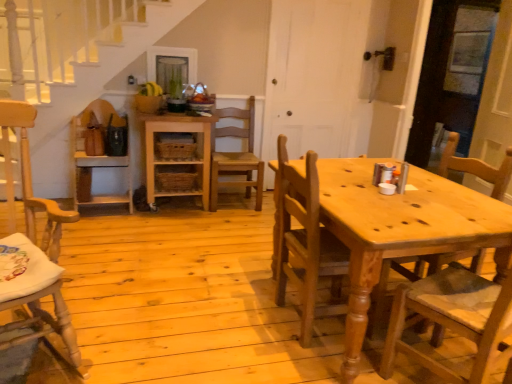
Measure the distance between point (20, 124) and camera.

Point (20, 124) and camera are 10.58 feet apart from each other.

Locate an element on the screen. This screenshot has width=512, height=384. natural wood chair at center, the 4th chair from the left is located at coordinates (304, 242).

This screenshot has height=384, width=512. I want to click on wooden chair at right, marked as the first chair in a right-to-left arrangement, so (x=450, y=320).

What do you see at coordinates (236, 156) in the screenshot? Image resolution: width=512 pixels, height=384 pixels. I see `wooden chair at center, the 3th chair viewed from the right` at bounding box center [236, 156].

This screenshot has width=512, height=384. Describe the element at coordinates (176, 156) in the screenshot. I see `natural wood shelf at center` at that location.

At what (x,y) coordinates should I click in order to perform the action: click on natural wood shelf at center. Please return your answer as a coordinate pair (x, y). Looking at the image, I should click on (176, 156).

You are a GUI agent. You are given a task and a screenshot of the screen. Output one action in this format:
    pyautogui.click(x=<x>, y=<y>)
    Task: Click on the light brown wood chair at left, marked as the 2th chair in a left-to-right arrangement
    The width and height of the screenshot is (512, 384).
    Given the screenshot: What is the action you would take?
    pyautogui.click(x=30, y=182)

Does point (419, 358) come closer to viewer compared to point (66, 338)?

No, it is not.

Based on the photo, considering the sizes of wooden chair at right, marked as the first chair in a right-to-left arrangement, and light brown wood chair at left, which is counted as the fourth chair, starting from the right, in the image, is wooden chair at right, marked as the first chair in a right-to-left arrangement, wider or thinner than light brown wood chair at left, which is counted as the fourth chair, starting from the right,?

wooden chair at right, marked as the first chair in a right-to-left arrangement, is thinner than light brown wood chair at left, which is counted as the fourth chair, starting from the right.

Is wooden chair at right, marked as the first chair in a right-to-left arrangement, turned away from light brown wood chair at left, marked as the 2th chair in a left-to-right arrangement?

wooden chair at right, marked as the first chair in a right-to-left arrangement, does not have its back to light brown wood chair at left, marked as the 2th chair in a left-to-right arrangement.

What's the angular difference between wooden chair at right, marked as the first chair in a right-to-left arrangement, and light brown wood chair at left, which is counted as the fourth chair, starting from the right,'s facing directions?

They differ by 178 degrees in their facing directions.

Is wooden chair at right, acting as the fifth chair starting from the left, thinner than wooden chair at center, arranged as the 3th chair when viewed from the left?

Yes, wooden chair at right, acting as the fifth chair starting from the left, is thinner than wooden chair at center, arranged as the 3th chair when viewed from the left.

Is wooden chair at right, marked as the first chair in a right-to-left arrangement, not within wooden chair at center, arranged as the 3th chair when viewed from the left?

Yes, wooden chair at right, marked as the first chair in a right-to-left arrangement, is located beyond the bounds of wooden chair at center, arranged as the 3th chair when viewed from the left.

In the scene shown: Considering the relative sizes of wooden chair at right, marked as the first chair in a right-to-left arrangement, and wooden chair at center, arranged as the 3th chair when viewed from the left, in the image provided, is wooden chair at right, marked as the first chair in a right-to-left arrangement, shorter than wooden chair at center, arranged as the 3th chair when viewed from the left,?

In fact, wooden chair at right, marked as the first chair in a right-to-left arrangement, may be taller than wooden chair at center, arranged as the 3th chair when viewed from the left.

Does point (457, 313) come in front of point (248, 155)?

Yes, point (457, 313) is closer to viewer.

Is light brown wood chair at left, which is counted as the fourth chair, starting from the right, looking in the opposite direction of wooden chair at center, the 3th chair viewed from the right?

No, wooden chair at center, the 3th chair viewed from the right, is not at the back of light brown wood chair at left, which is counted as the fourth chair, starting from the right.

Does light brown wood chair at left, which is counted as the fourth chair, starting from the right, have a larger size compared to wooden chair at center, arranged as the 3th chair when viewed from the left?

Yes, light brown wood chair at left, which is counted as the fourth chair, starting from the right, is bigger than wooden chair at center, arranged as the 3th chair when viewed from the left.

Between light brown wood chair at left, marked as the 2th chair in a left-to-right arrangement, and wooden chair at center, the 3th chair viewed from the right, which one has more height?

light brown wood chair at left, marked as the 2th chair in a left-to-right arrangement, is taller.

Considering the positions of objects natural wood chair at center, which appears as the second chair when viewed from the right, and wooden chair at right, acting as the fifth chair starting from the left, in the image provided, who is more to the left, natural wood chair at center, which appears as the second chair when viewed from the right, or wooden chair at right, acting as the fifth chair starting from the left,?

natural wood chair at center, which appears as the second chair when viewed from the right, is more to the left.

Considering the sizes of objects natural wood chair at center, which appears as the second chair when viewed from the right, and wooden chair at right, marked as the first chair in a right-to-left arrangement, in the image provided, who is taller, natural wood chair at center, which appears as the second chair when viewed from the right, or wooden chair at right, marked as the first chair in a right-to-left arrangement,?

With more height is wooden chair at right, marked as the first chair in a right-to-left arrangement.

Is the position of natural wood chair at center, which appears as the second chair when viewed from the right, less distant than that of wooden chair at right, marked as the first chair in a right-to-left arrangement?

No, the depth of natural wood chair at center, which appears as the second chair when viewed from the right, is greater than that of wooden chair at right, marked as the first chair in a right-to-left arrangement.

Is natural wood chair at center, the 4th chair from the left, bigger or smaller than wooden chair at right, marked as the first chair in a right-to-left arrangement?

In the image, natural wood chair at center, the 4th chair from the left, appears to be smaller than wooden chair at right, marked as the first chair in a right-to-left arrangement.

Is light brown wood chair at left, marked as the 2th chair in a left-to-right arrangement, far from wooden chair at right, marked as the first chair in a right-to-left arrangement?

Yes.

From the image's perspective, which object appears higher, light brown wood chair at left, marked as the 2th chair in a left-to-right arrangement, or wooden chair at right, acting as the fifth chair starting from the left?

light brown wood chair at left, marked as the 2th chair in a left-to-right arrangement, is shown above in the image.

Which object is positioned more to the left, light brown wood chair at left, marked as the 2th chair in a left-to-right arrangement, or wooden chair at right, marked as the first chair in a right-to-left arrangement?

light brown wood chair at left, marked as the 2th chair in a left-to-right arrangement, is more to the left.

Is light brown wood chair at left, marked as the 2th chair in a left-to-right arrangement, positioned behind wooden chair at right, acting as the fifth chair starting from the left?

That is False.

How many degrees apart are the facing directions of wooden chair at center, the 3th chair viewed from the right, and natural wood chair at center, the 4th chair from the left?

The angular difference between wooden chair at center, the 3th chair viewed from the right, and natural wood chair at center, the 4th chair from the left, is 91.5 degrees.

Where is `the 1st chair below the natural wood chair at center, which appears as the second chair when viewed from the right (from a real-world perspective)`? the 1st chair below the natural wood chair at center, which appears as the second chair when viewed from the right (from a real-world perspective) is located at coordinates (236, 156).

Is wooden chair at center, arranged as the 3th chair when viewed from the left, oriented away from natural wood chair at center, the 4th chair from the left?

No, wooden chair at center, arranged as the 3th chair when viewed from the left, is not facing away from natural wood chair at center, the 4th chair from the left.

Is wooden chair at center, arranged as the 3th chair when viewed from the left, smaller than natural wood chair at center, the 4th chair from the left?

No.

Is the position of natural wood chair at center, the 4th chair from the left, more distant than that of wooden chair at center, which is counted as the 5th chair, starting from the right?

No, the depth of natural wood chair at center, the 4th chair from the left, is less than that of wooden chair at center, which is counted as the 5th chair, starting from the right.

Could you measure the distance between natural wood chair at center, the 4th chair from the left, and wooden chair at center, the first chair positioned from the left?

6.28 feet.

Is natural wood chair at center, which appears as the second chair when viewed from the right, to the left of wooden chair at center, which is counted as the 5th chair, starting from the right, from the viewer's perspective?

No, natural wood chair at center, which appears as the second chair when viewed from the right, is not to the left of wooden chair at center, which is counted as the 5th chair, starting from the right.

Considering the points (314, 231) and (88, 198), which point is in front, point (314, 231) or point (88, 198)?

The point (314, 231) is in front.

Where is `chair in front of the wooden chair at right, acting as the fifth chair starting from the left`? chair in front of the wooden chair at right, acting as the fifth chair starting from the left is located at coordinates (30, 182).

From the image's perspective, which chair is the 4th one below the wooden chair at center, arranged as the 3th chair when viewed from the left? Please provide its 2D coordinates.

[(450, 320)]

When comparing their distances from wooden chair at center, which is counted as the 5th chair, starting from the right, does natural wood chair at center, the 4th chair from the left, or wooden chair at center, the 3th chair viewed from the right, seem closer?

Among the two, wooden chair at center, the 3th chair viewed from the right, is located nearer to wooden chair at center, which is counted as the 5th chair, starting from the right.

Based on their spatial positions, is wooden chair at right, acting as the fifth chair starting from the left, or natural wood shelf at center closer to wooden chair at center, the 3th chair viewed from the right?

Based on the image, natural wood shelf at center appears to be nearer to wooden chair at center, the 3th chair viewed from the right.

Looking at the image, which one is located closer to wooden chair at right, marked as the first chair in a right-to-left arrangement, natural wood shelf at center or wooden chair at center, which is counted as the 5th chair, starting from the right?

Among the two, natural wood shelf at center is located nearer to wooden chair at right, marked as the first chair in a right-to-left arrangement.

Considering their positions, is light brown wood chair at left, marked as the 2th chair in a left-to-right arrangement, positioned closer to natural wood chair at center, the 4th chair from the left, than natural wood shelf at center?

light brown wood chair at left, marked as the 2th chair in a left-to-right arrangement.

Estimate the real-world distances between objects in this image. Which object is further from natural wood shelf at center, wooden chair at center, the 3th chair viewed from the right, or light brown wood chair at left, which is counted as the fourth chair, starting from the right?

The object further to natural wood shelf at center is light brown wood chair at left, which is counted as the fourth chair, starting from the right.

Estimate the real-world distances between objects in this image. Which object is closer to wooden chair at right, acting as the fifth chair starting from the left, natural wood shelf at center or light brown wood chair at left, marked as the 2th chair in a left-to-right arrangement?

light brown wood chair at left, marked as the 2th chair in a left-to-right arrangement, lies closer to wooden chair at right, acting as the fifth chair starting from the left, than the other object.

Looking at the image, which one is located closer to light brown wood chair at left, which is counted as the fourth chair, starting from the right, wooden chair at center, the 3th chair viewed from the right, or wooden chair at right, acting as the fifth chair starting from the left?

The object closer to light brown wood chair at left, which is counted as the fourth chair, starting from the right, is wooden chair at right, acting as the fifth chair starting from the left.

Based on their spatial positions, is natural wood shelf at center or light brown wood chair at left, marked as the 2th chair in a left-to-right arrangement, further from natural wood chair at center, the 4th chair from the left?

Among the two, natural wood shelf at center is located further to natural wood chair at center, the 4th chair from the left.

The image size is (512, 384). In order to click on shelf between wooden chair at center, which is counted as the 5th chair, starting from the right, and wooden chair at right, acting as the fifth chair starting from the left, in the horizontal direction in this screenshot , I will do `click(176, 156)`.

Locate an element on the screen. chair located between natural wood chair at center, which appears as the second chair when viewed from the right, and wooden chair at center, the 3th chair viewed from the right, in the depth direction is located at coordinates (96, 154).

Find the location of a particular element. This screenshot has width=512, height=384. shelf between light brown wood chair at left, marked as the 2th chair in a left-to-right arrangement, and wooden chair at center, arranged as the 3th chair when viewed from the left, in the front-back direction is located at coordinates (176, 156).

I want to click on shelf between wooden chair at right, acting as the fifth chair starting from the left, and wooden chair at center, arranged as the 3th chair when viewed from the left, from front to back, so click(x=176, y=156).